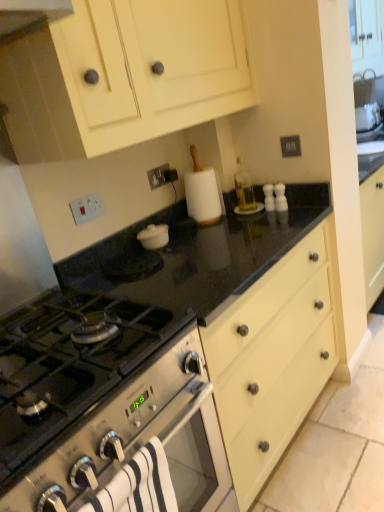
In order to face stainless steel gas stove at lower left, should I rotate leftwards or rightwards?

You should rotate left by 18.345 degrees.

You are a GUI agent. You are given a task and a screenshot of the screen. Output one action in this format:
    pyautogui.click(x=<x>, y=<y>)
    Task: Click on the white striped towel at lower left
    This screenshot has height=512, width=384.
    Given the screenshot: What is the action you would take?
    pyautogui.click(x=138, y=485)

Between matte cream cabinet at upper center and black granite countertop at center, which one has more height?

black granite countertop at center.

Considering the sizes of objects matte cream cabinet at upper center and black granite countertop at center in the image provided, who is smaller, matte cream cabinet at upper center or black granite countertop at center?

Smaller between the two is matte cream cabinet at upper center.

From a real-world perspective, does matte cream cabinet at upper center stand above black granite countertop at center?

Yes, from a real-world perspective, matte cream cabinet at upper center is over black granite countertop at center

Consider the image. In terms of width, does matte cream cabinet at upper center look wider or thinner when compared to black granite countertop at center?

In the image, matte cream cabinet at upper center appears to be more narrow than black granite countertop at center.

Is black granite countertop at center turned away from white striped towel at lower left?

No, black granite countertop at center is not facing the opposite direction of white striped towel at lower left.

Which object is closer to the camera, black granite countertop at center or white striped towel at lower left?

white striped towel at lower left is closer to the camera.

From a real-world perspective, is black granite countertop at center positioned over white striped towel at lower left based on gravity?

Actually, black granite countertop at center is physically below white striped towel at lower left in the real world.

Is stainless steel gas stove at lower left thinner than black granite countertop at center?

Incorrect, the width of stainless steel gas stove at lower left is not less than that of black granite countertop at center.

Is stainless steel gas stove at lower left bigger than black granite countertop at center?

Actually, stainless steel gas stove at lower left might be smaller than black granite countertop at center.

Which is in front, stainless steel gas stove at lower left or black granite countertop at center?

stainless steel gas stove at lower left.

Is stainless steel gas stove at lower left oriented towards black granite countertop at center?

No, stainless steel gas stove at lower left is not aimed at black granite countertop at center.

Would you say black granite countertop at center is a long distance from stainless steel gas stove at lower left?

No, black granite countertop at center is not far from stainless steel gas stove at lower left.

Can you confirm if black granite countertop at center is positioned to the right of stainless steel gas stove at lower left?

Yes, black granite countertop at center is to the right of stainless steel gas stove at lower left.

Consider the image. Who is shorter, black granite countertop at center or stainless steel gas stove at lower left?

With less height is stainless steel gas stove at lower left.

Which object is closer to the camera, black granite countertop at center or stainless steel gas stove at lower left?

stainless steel gas stove at lower left is closer to the camera.

Does matte cream cabinet at upper center have a larger size compared to white striped towel at lower left?

Correct, matte cream cabinet at upper center is larger in size than white striped towel at lower left.

Can you tell me how much matte cream cabinet at upper center and white striped towel at lower left differ in facing direction?

matte cream cabinet at upper center and white striped towel at lower left are facing 1.41 degrees away from each other.

From the picture: Is matte cream cabinet at upper center at the right side of white striped towel at lower left?

No.

Identify the location of cabinetry on the left of black granite countertop at center. This screenshot has height=512, width=384. (123, 75).

Does black granite countertop at center have a larger size compared to matte cream cabinet at upper center?

Yes.

Between black granite countertop at center and matte cream cabinet at upper center, which one has less height?

Standing shorter between the two is matte cream cabinet at upper center.

From the image's perspective, which is above, black granite countertop at center or matte cream cabinet at upper center?

From the image's view, matte cream cabinet at upper center is above.

Considering the relative positions of matte cream cabinet at upper center and stainless steel gas stove at lower left in the image provided, is matte cream cabinet at upper center to the left or to the right of stainless steel gas stove at lower left?

matte cream cabinet at upper center is to the right of stainless steel gas stove at lower left.

Is matte cream cabinet at upper center oriented away from stainless steel gas stove at lower left?

No, matte cream cabinet at upper center is not facing away from stainless steel gas stove at lower left.

In terms of size, does matte cream cabinet at upper center appear bigger or smaller than stainless steel gas stove at lower left?

Considering their sizes, matte cream cabinet at upper center takes up more space than stainless steel gas stove at lower left.

Find the location of a particular element. countertop that appears below the matte cream cabinet at upper center (from a real-world perspective) is located at coordinates (170, 357).

I want to click on bath towel on the left of black granite countertop at center, so click(x=138, y=485).

Looking at the image, which one is located further to white striped towel at lower left, matte cream cabinet at upper center or stainless steel gas stove at lower left?

The object further to white striped towel at lower left is matte cream cabinet at upper center.

From the image, which object appears to be farther from stainless steel gas stove at lower left, matte cream cabinet at upper center or white striped towel at lower left?

matte cream cabinet at upper center lies further to stainless steel gas stove at lower left than the other object.

Consider the image. From the image, which object appears to be nearer to black granite countertop at center, matte cream cabinet at upper center or stainless steel gas stove at lower left?

Among the two, stainless steel gas stove at lower left is located nearer to black granite countertop at center.

Which object lies nearer to the anchor point black granite countertop at center, white striped towel at lower left or stainless steel gas stove at lower left?

stainless steel gas stove at lower left lies closer to black granite countertop at center than the other object.

Which object lies further to the anchor point matte cream cabinet at upper center, white striped towel at lower left or black granite countertop at center?

Among the two, white striped towel at lower left is located further to matte cream cabinet at upper center.

Based on their spatial positions, is black granite countertop at center or matte cream cabinet at upper center further from white striped towel at lower left?

Based on the image, matte cream cabinet at upper center appears to be further to white striped towel at lower left.

Estimate the real-world distances between objects in this image. Which object is closer to matte cream cabinet at upper center, white striped towel at lower left or stainless steel gas stove at lower left?

stainless steel gas stove at lower left is positioned closer to the anchor matte cream cabinet at upper center.

Which object lies nearer to the anchor point white striped towel at lower left, stainless steel gas stove at lower left or matte cream cabinet at upper center?

stainless steel gas stove at lower left lies closer to white striped towel at lower left than the other object.

The width and height of the screenshot is (384, 512). Find the location of `gas stove that lies between matte cream cabinet at upper center and white striped towel at lower left from top to bottom`. gas stove that lies between matte cream cabinet at upper center and white striped towel at lower left from top to bottom is located at coordinates (70, 364).

Locate an element on the screen. This screenshot has width=384, height=512. countertop between matte cream cabinet at upper center and white striped towel at lower left vertically is located at coordinates (170, 357).

You are a GUI agent. You are given a task and a screenshot of the screen. Output one action in this format:
    pyautogui.click(x=<x>, y=<y>)
    Task: Click on the bath towel between stainless steel gas stove at lower left and black granite countertop at center
    
    Given the screenshot: What is the action you would take?
    pyautogui.click(x=138, y=485)

Where is `gas stove between matte cream cabinet at upper center and black granite countertop at center in the up-down direction`? gas stove between matte cream cabinet at upper center and black granite countertop at center in the up-down direction is located at coordinates (70, 364).